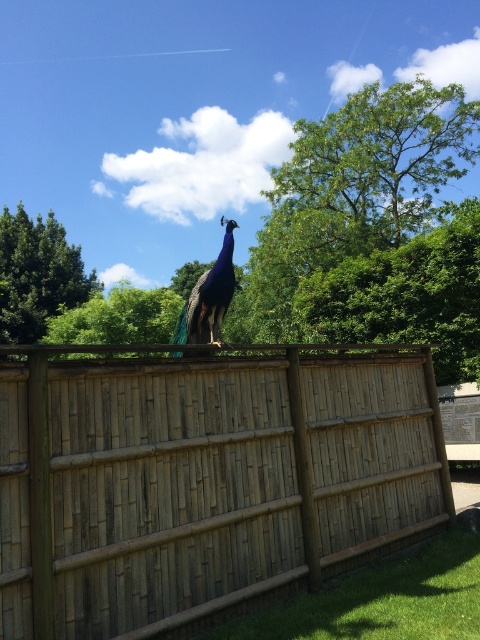
Is point (157, 620) positioned before point (421, 317)?

Yes, it is in front of point (421, 317).

Does brown wooden fence at center have a greater height compared to green leafy tree at upper center?

Yes, brown wooden fence at center is taller than green leafy tree at upper center.

What are the coordinates of `brown wooden fence at center` in the screenshot? It's located at (204, 477).

Which is more to the right, brown wooden fence at center or green leafy tree at upper left?

From the viewer's perspective, brown wooden fence at center appears more on the right side.

Does brown wooden fence at center have a smaller size compared to green leafy tree at upper left?

Correct, brown wooden fence at center occupies less space than green leafy tree at upper left.

Which is behind, point (328, 392) or point (75, 289)?

Point (75, 289)

At what (x,y) coordinates should I click in order to perform the action: click on brown wooden fence at center. Please return your answer as a coordinate pair (x, y). Looking at the image, I should click on (204, 477).

Does green leafy tree at upper center come in front of green leafy tree at upper left?

Yes.

The image size is (480, 640). What are the coordinates of `green leafy tree at upper center` in the screenshot? It's located at (406, 294).